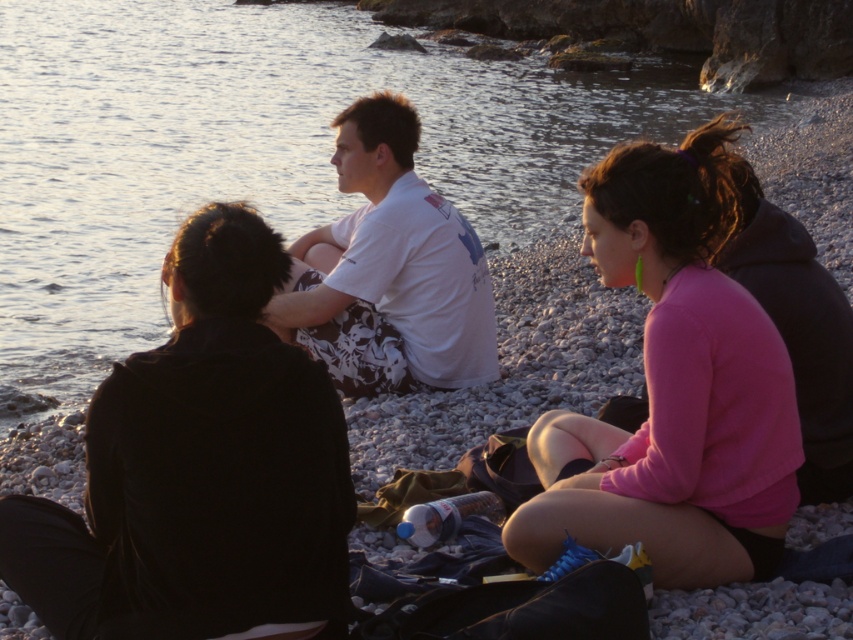
Question: Considering the real-world distances, which object is farthest from the pink fleece sweatshirt at center?

Choices:
 (A) clear water at center
 (B) white printed shirt at center

Answer: (A)

Question: Does clear water at center have a larger size compared to black matte jacket at left?

Choices:
 (A) yes
 (B) no

Answer: (A)

Question: Among these objects, which one is farthest from the camera?

Choices:
 (A) white printed shirt at center
 (B) black matte jacket at left
 (C) clear water at center

Answer: (C)

Question: Does clear water at center come behind pink fleece sweatshirt at center?

Choices:
 (A) no
 (B) yes

Answer: (B)

Question: Which point is farther to the camera?

Choices:
 (A) pink fleece sweatshirt at center
 (B) white printed shirt at center
 (C) clear water at center

Answer: (C)

Question: Can you confirm if black matte jacket at left is positioned below white printed shirt at center?

Choices:
 (A) no
 (B) yes

Answer: (B)